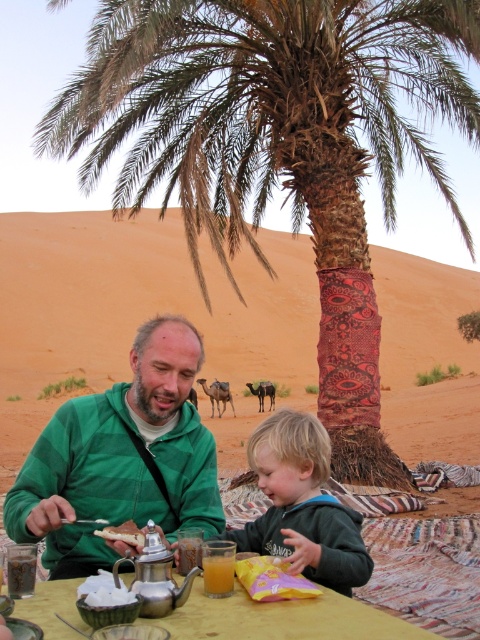
You are planning to set up a tent for shade during a desert picnic. You have the brown textured palm tree at center and the green fleece jacket at lower center in view. Which object provides more shade coverage for your tent? Please explain based on their positions.

The brown textured palm tree at center provides more shade coverage for your tent because it is positioned over the green fleece jacket at lower center, indicating it casts a larger shadow over that area.

You are planning to set up a small tent for shade in the desert scene. The tent requires a minimum height of 2 meters to be functional. Given the objects present, can the brown textured palm tree at center provide sufficient height for the tent? Please consider the height of the translucent glass juice at lower center as a reference.

The brown textured palm tree at center has a greater height compared to the translucent glass juice at lower center. Since the palm tree is taller than the juice glass, and assuming the juice glass is a standard size, the palm tree likely exceeds the 2 meter requirement for the tent. Therefore, the brown textured palm tree at center can provide sufficient height for the tent.